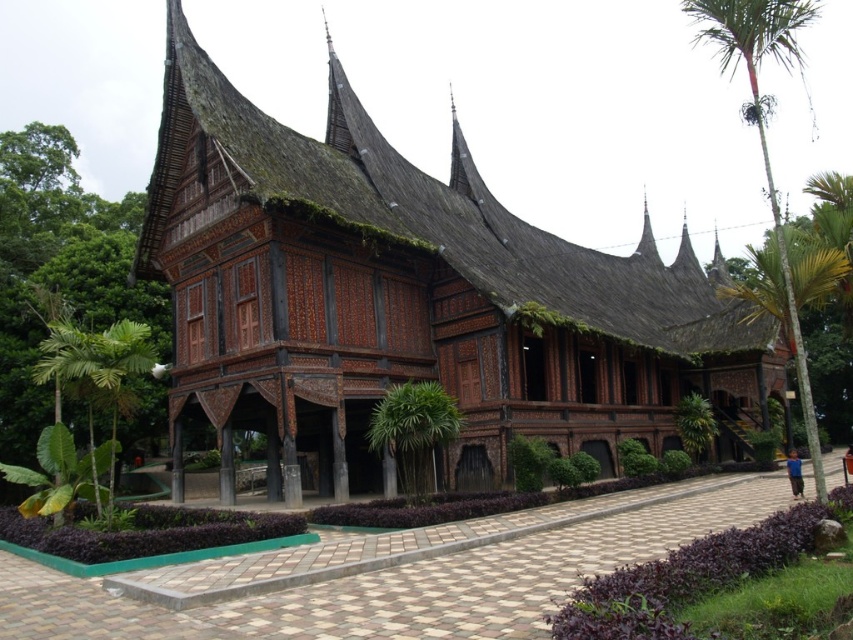
Question: Does green leafy palm tree at left have a smaller size compared to green leafy palm tree at center?

Choices:
 (A) yes
 (B) no

Answer: (B)

Question: Which object is positioned farthest from the green leafy tree at left?

Choices:
 (A) green leafy palm tree at center
 (B) green leafy palm tree at left

Answer: (A)

Question: Is dark brown wood house at center wider than green leafy tree at left?

Choices:
 (A) yes
 (B) no

Answer: (A)

Question: Which of the following is the closest to the observer?

Choices:
 (A) (734, 38)
 (B) (120, 410)
 (C) (415, 461)

Answer: (A)

Question: Considering the real-world distances, which object is farthest from the green leafy palm tree at center?

Choices:
 (A) green leafy tree at left
 (B) green leafy palm tree at right

Answer: (A)

Question: Does green leafy palm tree at left appear over green leafy palm tree at center?

Choices:
 (A) yes
 (B) no

Answer: (A)